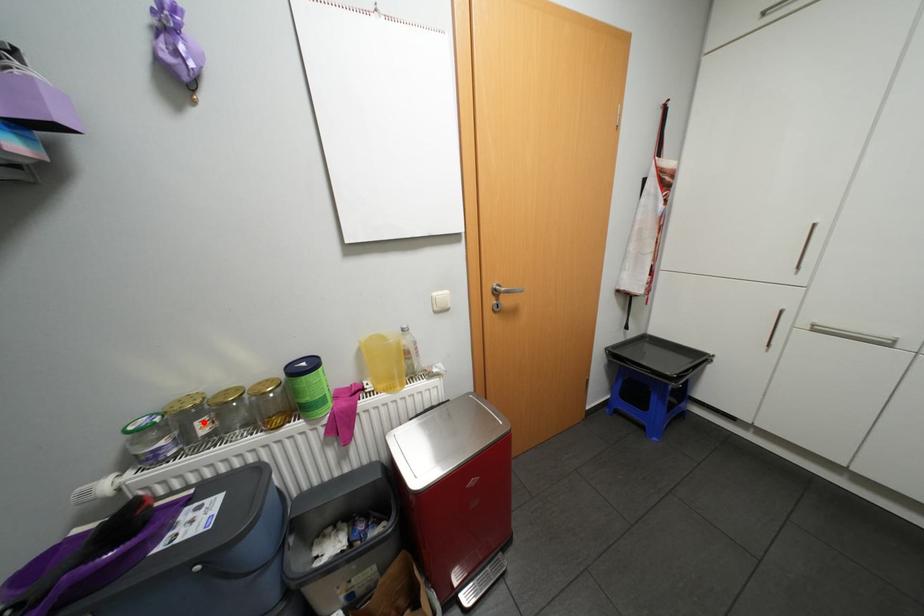
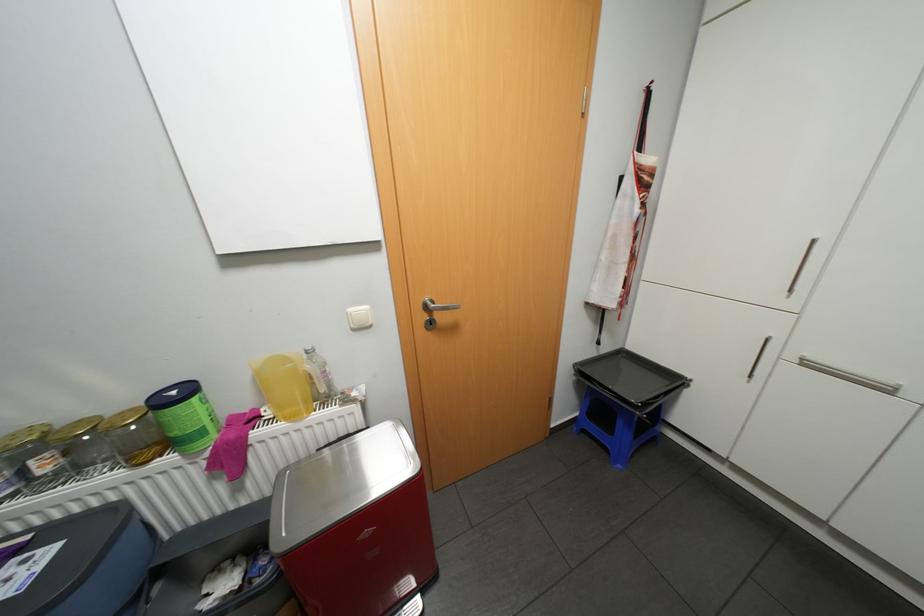
Find the pixel in the second image that matches the highlighted location in the first image.

(39, 461)